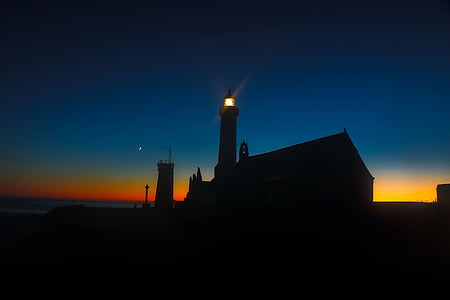
Identify the location of light. This screenshot has height=300, width=450. (228, 101).